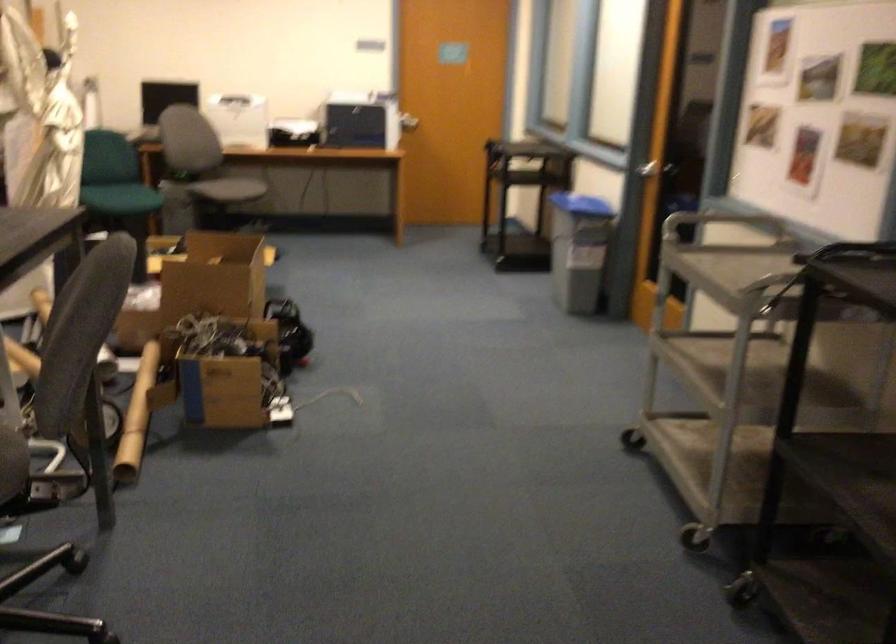
The width and height of the screenshot is (896, 644). What do you see at coordinates (857, 252) in the screenshot?
I see `the black cart handle` at bounding box center [857, 252].